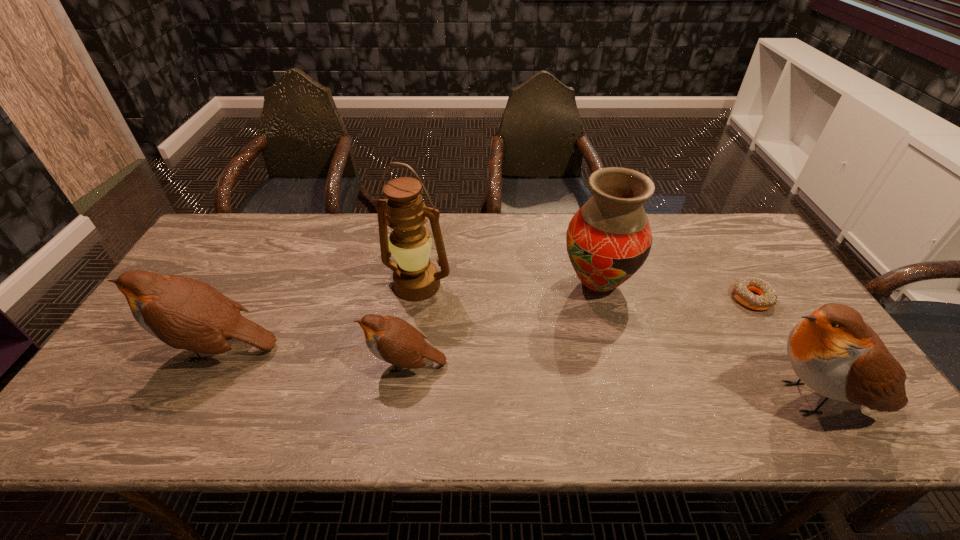
The height and width of the screenshot is (540, 960). Find the location of `free space for an extra bird to achieve even spacing`. free space for an extra bird to achieve even spacing is located at coordinates (606, 380).